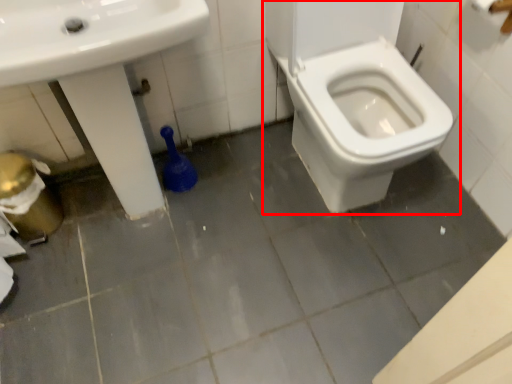
Question: From the image's perspective, where is toilet (annotated by the red box) located relative to sink?

Choices:
 (A) above
 (B) below

Answer: (A)